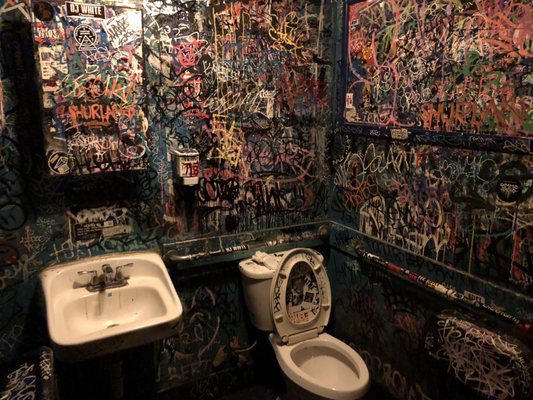
You are a GUI agent. You are given a task and a screenshot of the screen. Output one action in this format:
    pyautogui.click(x=<x>, y=<y>)
    Task: Click on the top right side of toilet bowl rim
    This screenshot has height=400, width=533.
    Given the screenshot: What is the action you would take?
    pyautogui.click(x=354, y=353)